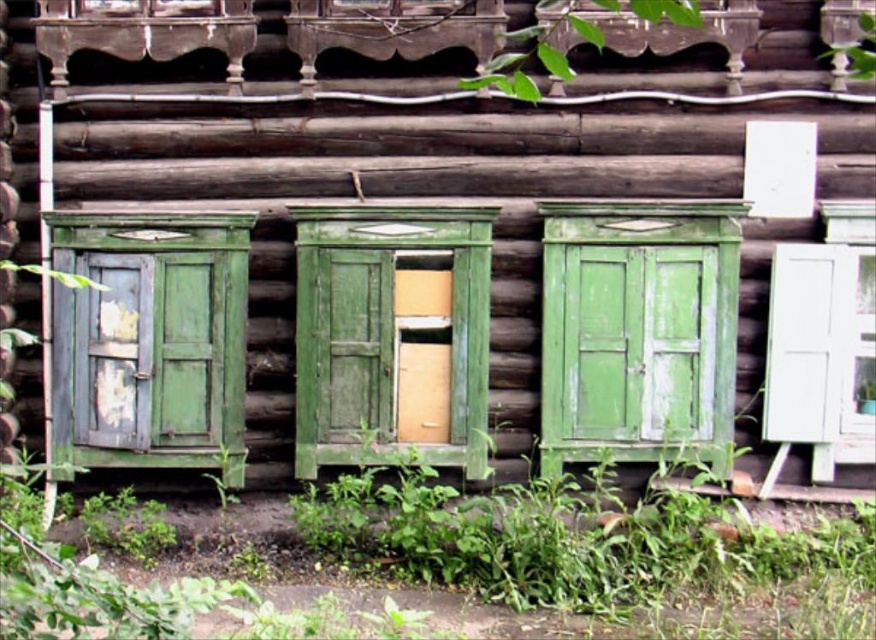
Does point (597, 378) come behind point (288, 208)?

Yes, point (597, 378) is farther from viewer.

Does green matte cabinet at center have a larger size compared to green wood cabinet at center?

No, green matte cabinet at center is not bigger than green wood cabinet at center.

Where is `green matte cabinet at center`? The height and width of the screenshot is (640, 876). green matte cabinet at center is located at coordinates (638, 332).

This screenshot has width=876, height=640. In order to click on green matte cabinet at center in this screenshot , I will do `click(638, 332)`.

Who is positioned more to the right, green matte cabinet at center or green leafy plant at upper center?

Positioned to the right is green matte cabinet at center.

Where is `green matte cabinet at center`? This screenshot has height=640, width=876. green matte cabinet at center is located at coordinates (638, 332).

Between point (597, 374) and point (673, 19), which one is positioned behind?

Point (597, 374)

Identify the location of green matte cabinet at center. This screenshot has width=876, height=640. (638, 332).

Is green wood cabinet at center to the left of green matte cabinet at left from the viewer's perspective?

Incorrect, green wood cabinet at center is not on the left side of green matte cabinet at left.

Between green wood cabinet at center and green matte cabinet at left, which one is positioned higher?

Positioned higher is green wood cabinet at center.

Identify the location of green wood cabinet at center. This screenshot has width=876, height=640. (392, 337).